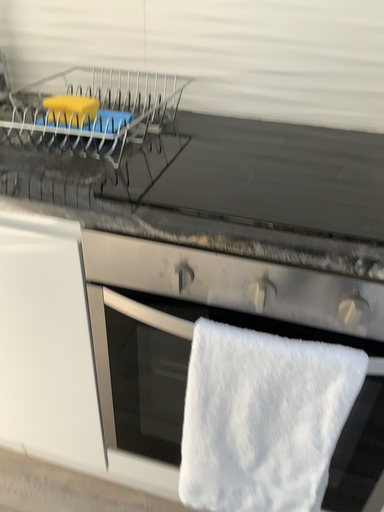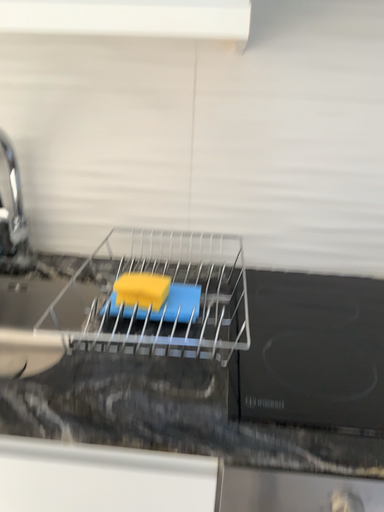
Question: How did the camera likely rotate when shooting the video?

Choices:
 (A) rotated upward
 (B) rotated downward

Answer: (A)